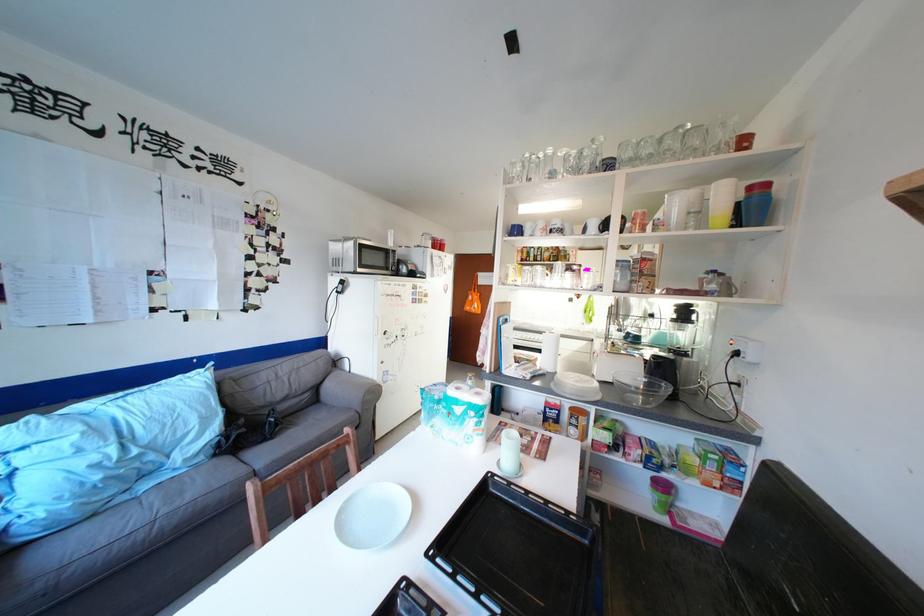
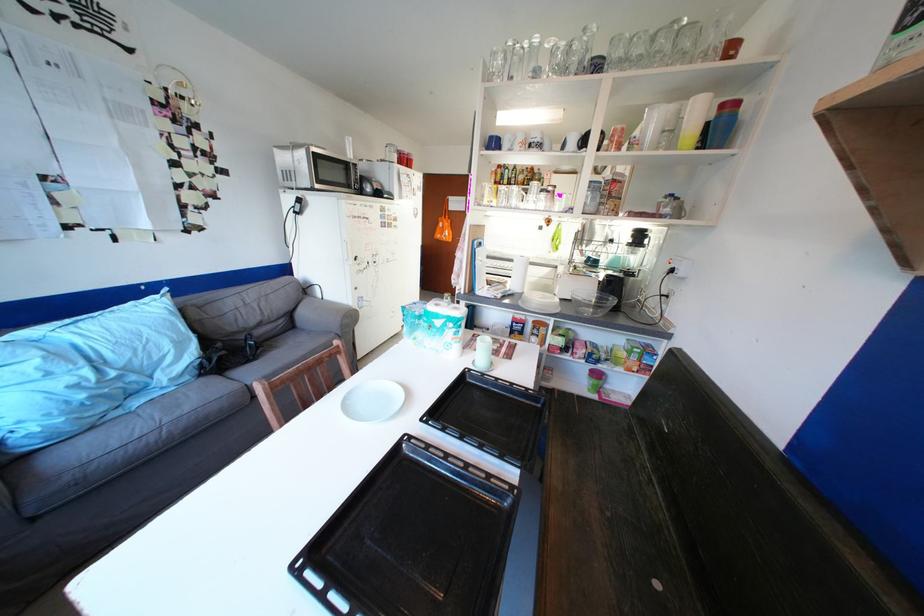
Where in the second image is the point corresponding to [501,477] from the first image?

(477, 371)